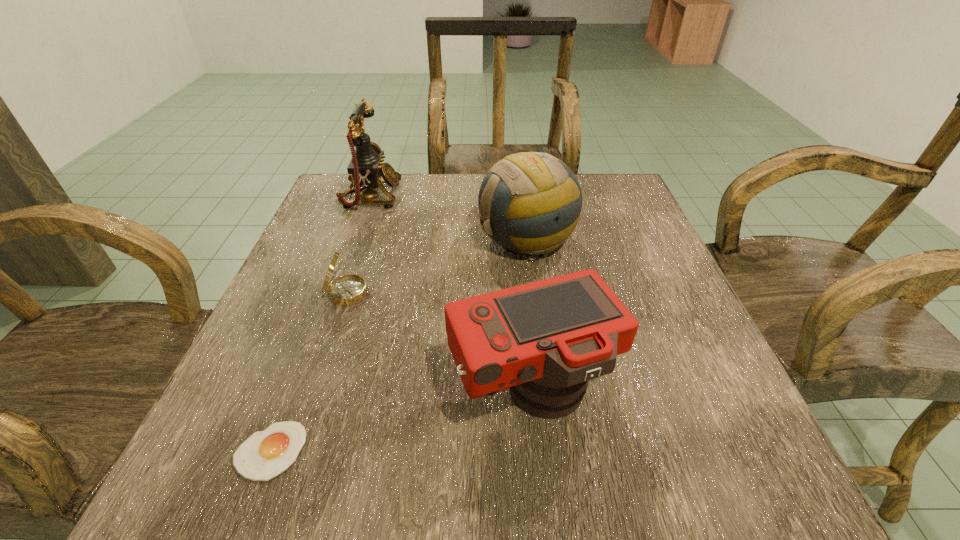
Image resolution: width=960 pixels, height=540 pixels. Find the location of `telephone`. telephone is located at coordinates (366, 167).

This screenshot has width=960, height=540. In order to click on volleyball in this screenshot , I will do `click(530, 203)`.

You are a GUI agent. You are given a task and a screenshot of the screen. Output one action in this format:
    pyautogui.click(x=<x>, y=<y>)
    Task: Click on the camera
    This screenshot has width=960, height=540.
    Given the screenshot: What is the action you would take?
    pyautogui.click(x=545, y=340)

Identify the location of the second shortest object. Image resolution: width=960 pixels, height=540 pixels. (349, 289).

Identify the location of the third farthest object. The height and width of the screenshot is (540, 960). (349, 289).

Find the location of a particular element. The height and width of the screenshot is (540, 960). egg yolk is located at coordinates (265, 454).

Find the location of `free space located on the front of the telephone, featuring the rotary dial`. free space located on the front of the telephone, featuring the rotary dial is located at coordinates (444, 196).

At what (x,y) coordinates should I click in order to perform the action: click on vacant point located on the back of the volleyball. Please return your answer as a coordinate pair (x, y). This screenshot has height=540, width=960. Looking at the image, I should click on (519, 181).

This screenshot has width=960, height=540. I want to click on vacant space located on the back of the camera, so click(519, 276).

I want to click on vacant space located with the dial facing the fourth tallest object, so tap(509, 293).